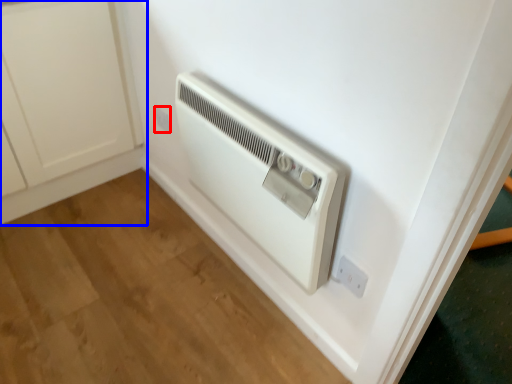
Question: Which object appears farthest to the camera in this image, electric outlet (highlighted by a red box) or cabinetry (highlighted by a blue box)?

Choices:
 (A) electric outlet
 (B) cabinetry

Answer: (A)